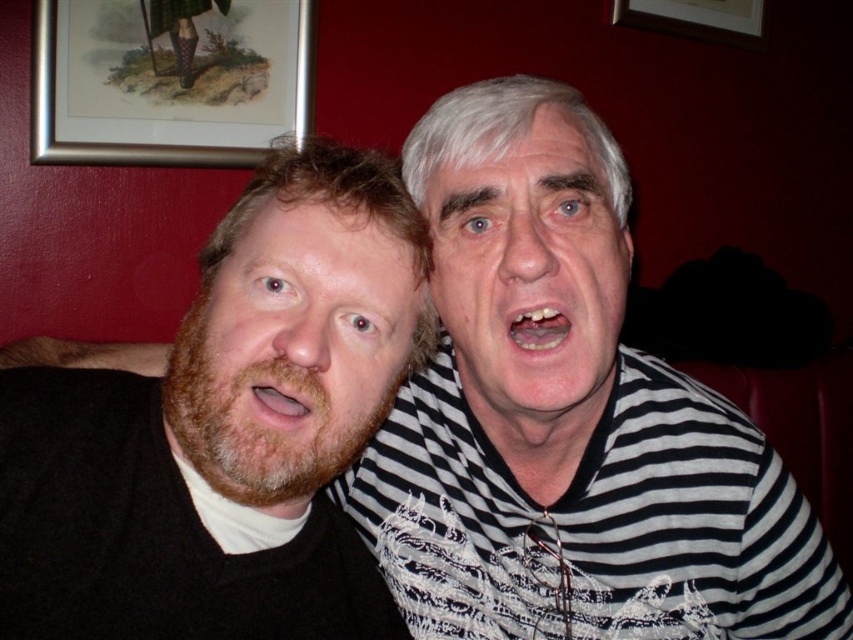
You are an interior designer assessing the wall space in this image. The brownwoollybeard at left and the wooden picture frame at upper center are both on the same wall. Which object takes up more space on the wall?

The wooden picture frame at upper center takes up more space on the wall because the brownwoollybeard at left has a smaller size compared to it.

You are a painter who needs to hang a new picture frame that is 1 meter tall on the wall. You want to place it so it doesn t block the brownwoollybeard at left or the wooden picture frame at upper center. Is there enough space between them to fit the new frame?

The distance between the brownwoollybeard at left and the wooden picture frame at upper center is 1.84 meters. Since the new frame is 1 meter tall, there is sufficient space between them to fit it without blocking either object.

You are an artist trying to recreate the scene. You need to place the white striped shirt at center in your drawing. What are the coordinates where you should position it?

The white striped shirt at center should be positioned at coordinates (x=531, y=273).